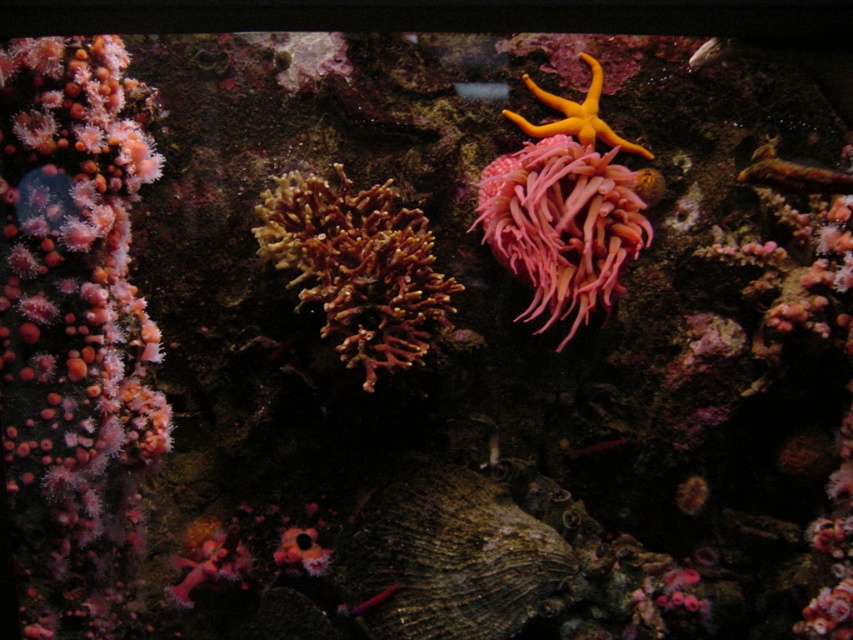
Question: From the image, what is the correct spatial relationship of rough textured shell at center in relation to pink soft coral at center?

Choices:
 (A) above
 (B) below

Answer: (B)

Question: Which is farther from the orange rubber starfish at upper center?

Choices:
 (A) pink coral at left
 (B) pink soft coral at center
 (C) rough textured shell at center
 (D) brown textured coral at center

Answer: (C)

Question: Considering the real-world distances, which object is closest to the pink coral at left?

Choices:
 (A) pink soft coral at center
 (B) brown textured coral at center
 (C) rough textured shell at center
 (D) orange rubber starfish at upper center

Answer: (B)

Question: Is pink coral at left wider than pink soft coral at center?

Choices:
 (A) yes
 (B) no

Answer: (B)

Question: Considering the real-world distances, which object is closest to the brown textured coral at center?

Choices:
 (A) rough textured shell at center
 (B) orange rubber starfish at upper center
 (C) pink coral at left
 (D) pink soft coral at center

Answer: (D)

Question: Observing the image, what is the correct spatial positioning of rough textured shell at center in reference to brown textured coral at center?

Choices:
 (A) right
 (B) left

Answer: (A)